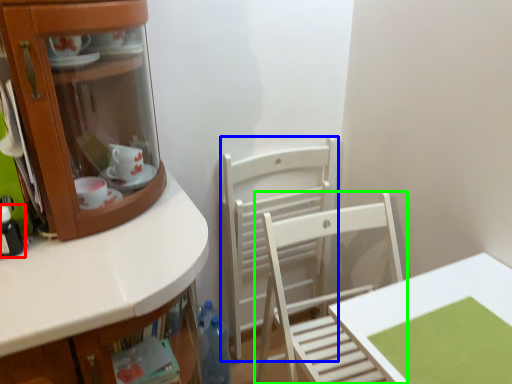
Question: Which object is positioned farthest from bottle (highlighted by a red box)? Select from chair (highlighted by a blue box) and chair (highlighted by a green box).

Choices:
 (A) chair
 (B) chair

Answer: (A)